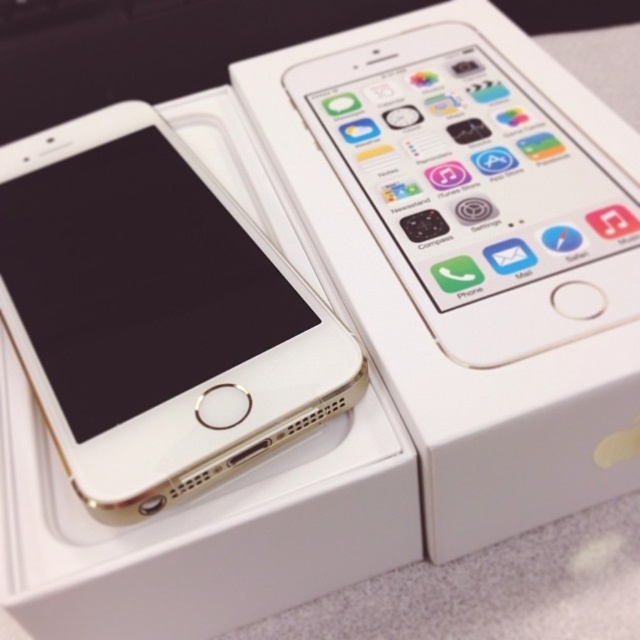
Is gold matte smartphone at upper left behind gold metallic smartphone at upper center?

No, gold matte smartphone at upper left is in front of gold metallic smartphone at upper center.

Consider the image. Is gold matte smartphone at upper left in front of gold metallic smartphone at upper center?

That is True.

You are a GUI agent. You are given a task and a screenshot of the screen. Output one action in this format:
    pyautogui.click(x=<x>, y=<y>)
    Task: Click on the gold matte smartphone at upper left
    Image resolution: width=640 pixels, height=640 pixels.
    Given the screenshot: What is the action you would take?
    pyautogui.click(x=156, y=314)

Find the location of a particular element. Image resolution: width=640 pixels, height=640 pixels. gold matte smartphone at upper left is located at coordinates (156, 314).